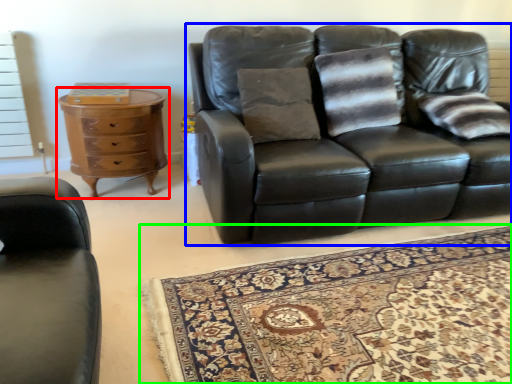
Question: Which object is positioned farthest from chest of drawers (highlighted by a red box)? Select from studio couch (highlighted by a blue box) and mat (highlighted by a green box).

Choices:
 (A) studio couch
 (B) mat

Answer: (B)